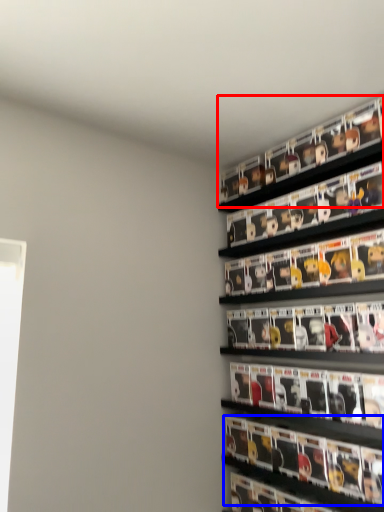
Question: Which point is further to the camera, shelf (highlighted by a red box) or magazine (highlighted by a blue box)?

Choices:
 (A) shelf
 (B) magazine

Answer: (A)